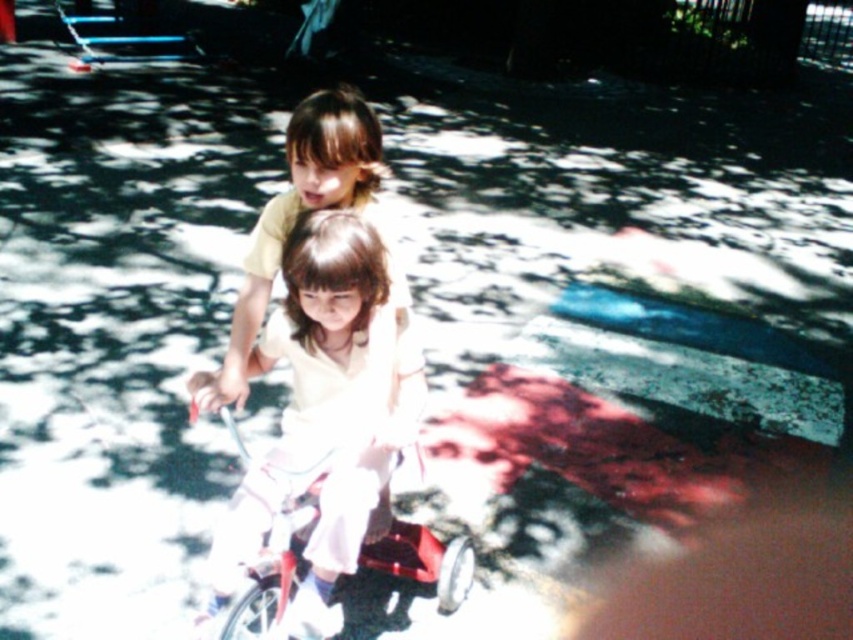
What do you see at coordinates (329, 332) in the screenshot?
I see `matte white shirt at center` at bounding box center [329, 332].

Does point (408, 332) come in front of point (294, 563)?

No, it is not.

This screenshot has width=853, height=640. I want to click on matte white shirt at center, so click(x=329, y=332).

Where is `matte white shirt at center`? This screenshot has width=853, height=640. matte white shirt at center is located at coordinates (329, 332).